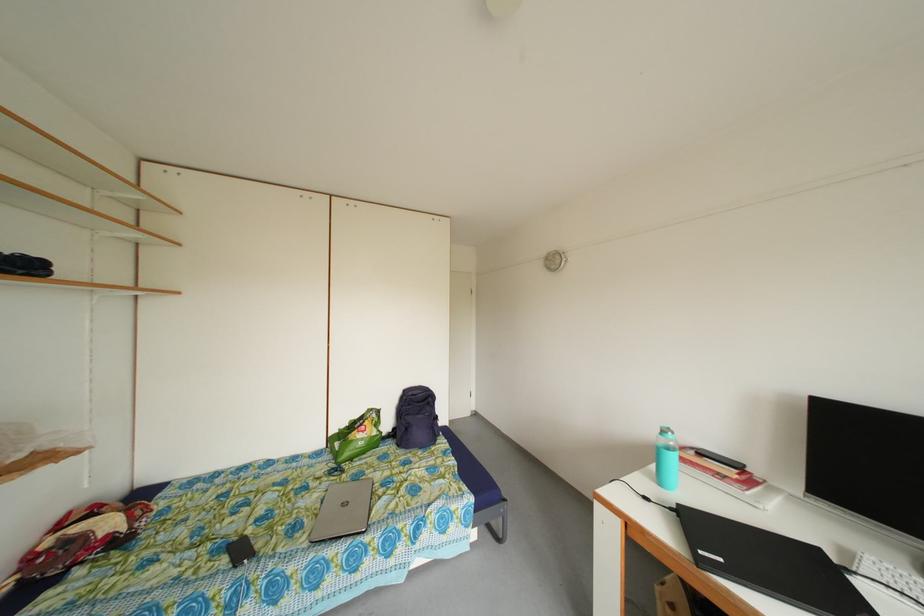
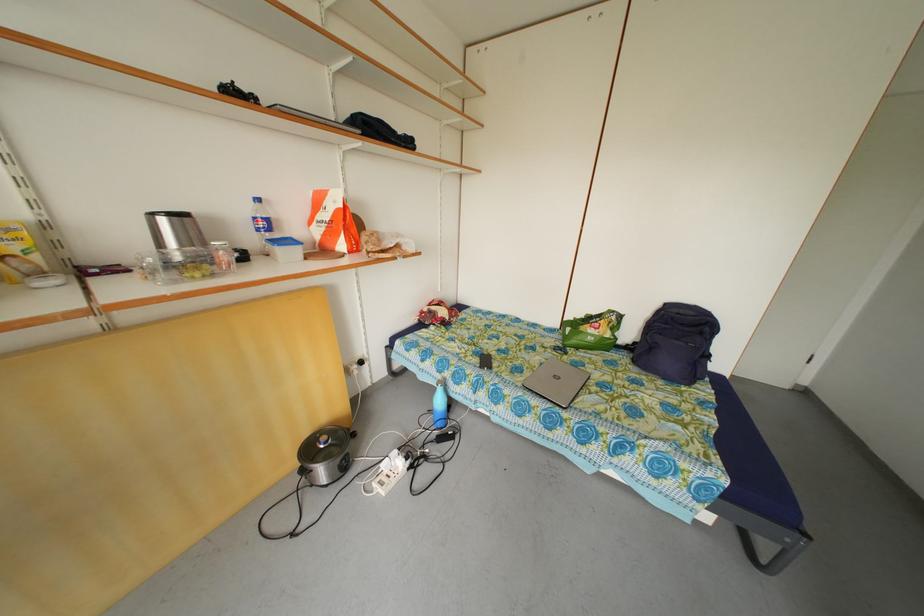
The first image is from the beginning of the video and the second image is from the end. How did the camera likely rotate when shooting the video?

The camera rotated toward left-down.